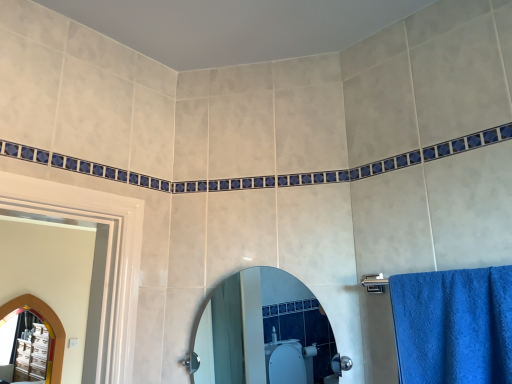
Question: Is arched wooden mirror at left, which is counted as the 1th mirror, starting from the back, inside or outside of clear glass mirror at center, positioned as the second mirror in back-to-front order?

Choices:
 (A) outside
 (B) inside

Answer: (A)

Question: From a real-world perspective, relative to clear glass mirror at center, the first mirror from the top, is arched wooden mirror at left, the 2th mirror positioned from the front, vertically above or below?

Choices:
 (A) below
 (B) above

Answer: (A)

Question: Based on their sizes in the image, would you say arched wooden mirror at left, arranged as the 2th mirror when viewed from the top, is bigger or smaller than clear glass mirror at center, placed as the second mirror when sorted from bottom to top?

Choices:
 (A) big
 (B) small

Answer: (A)

Question: Based on their positions, is clear glass mirror at center, placed as the second mirror when sorted from bottom to top, located to the left or right of arched wooden mirror at left, the 2th mirror positioned from the front?

Choices:
 (A) left
 (B) right

Answer: (B)

Question: Is clear glass mirror at center, placed as the second mirror when sorted from bottom to top, bigger or smaller than arched wooden mirror at left, which is counted as the 1th mirror, starting from the back?

Choices:
 (A) small
 (B) big

Answer: (A)

Question: In terms of width, does clear glass mirror at center, the first mirror from the top, look wider or thinner when compared to arched wooden mirror at left, which is counted as the 1th mirror, starting from the back?

Choices:
 (A) thin
 (B) wide

Answer: (B)

Question: From the image's perspective, is clear glass mirror at center, the 1th mirror positioned from the right, above or below arched wooden mirror at left, acting as the 2th mirror starting from the right?

Choices:
 (A) below
 (B) above

Answer: (B)